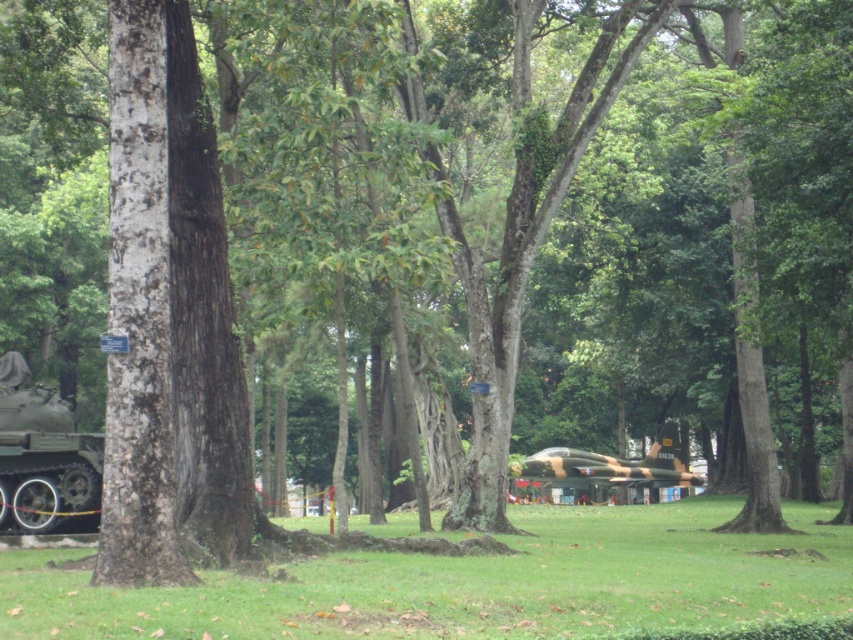
Between point (16, 502) and point (572, 467), which one is positioned behind?

Point (572, 467)

Which is more to the right, matte green tank at left or camouflage paint tank at center?

Positioned to the right is camouflage paint tank at center.

Where is `matte green tank at left`? The height and width of the screenshot is (640, 853). matte green tank at left is located at coordinates (44, 458).